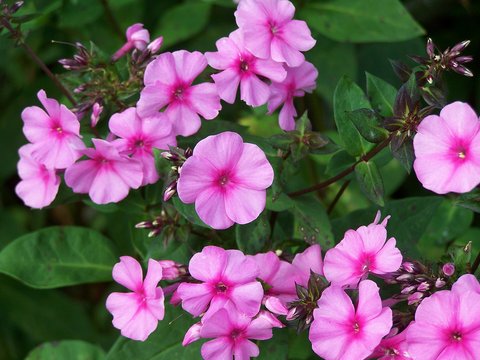
Where is `corner`? corner is located at coordinates (465, 351), (9, 348), (12, 34), (468, 13).